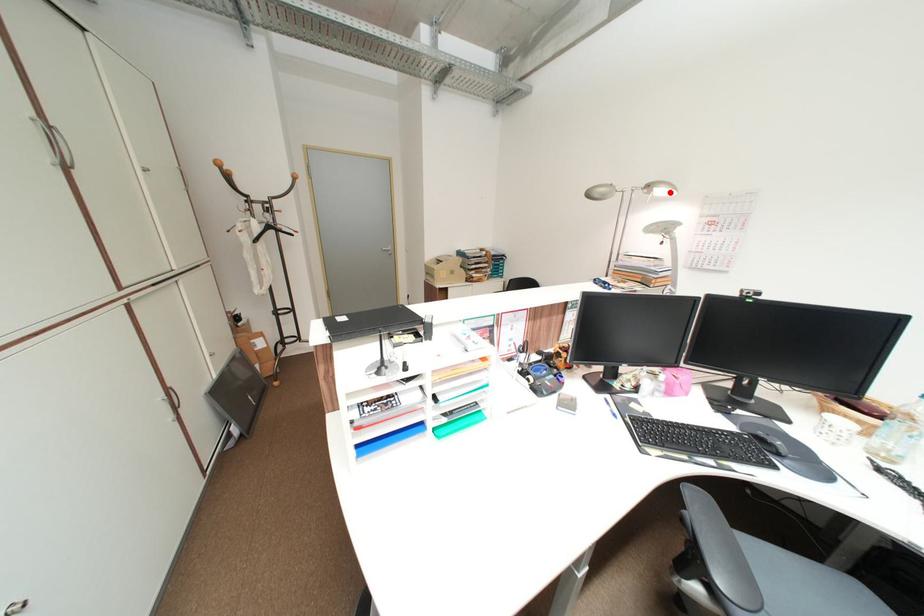
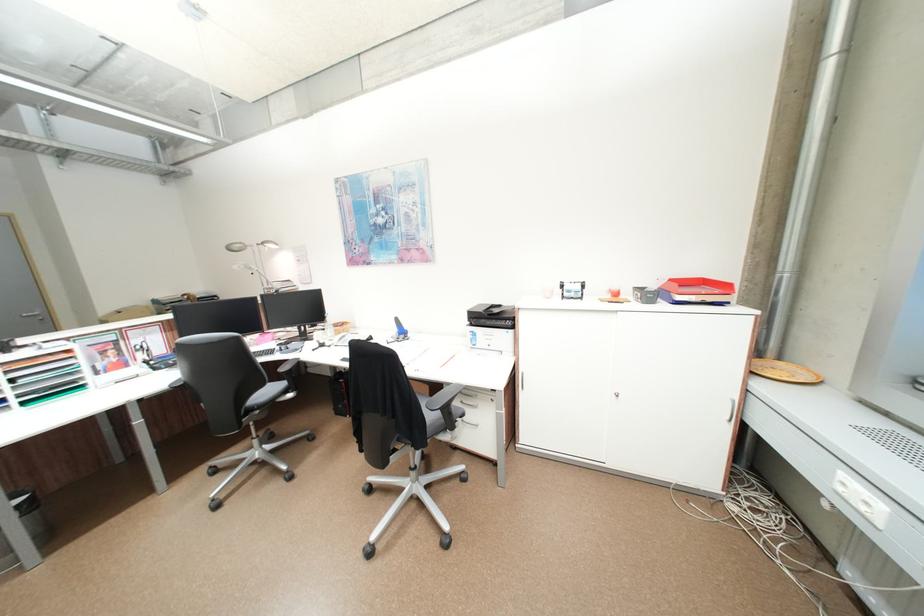
Find the pixel in the second image that matches the highlighted location in the first image.

(281, 246)